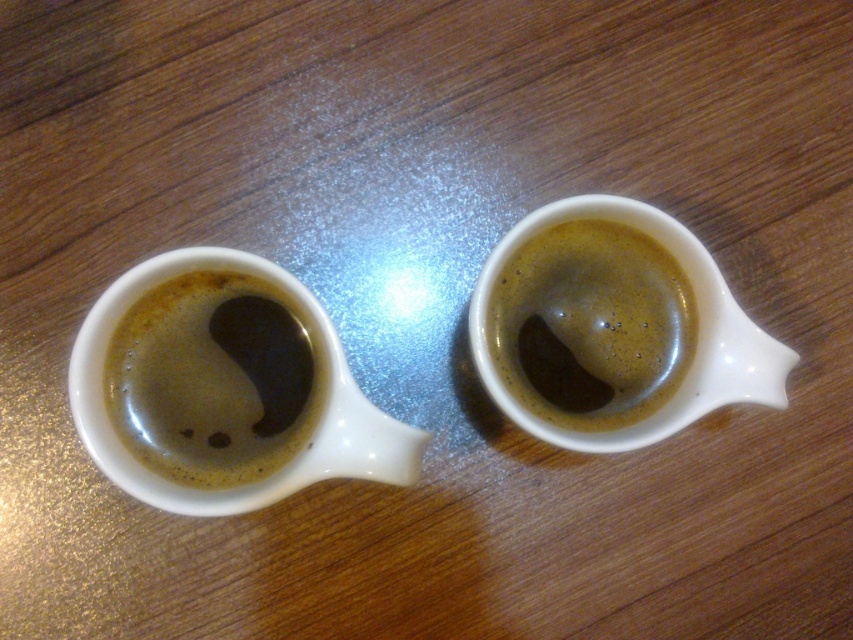
Question: Which point is closer to the camera?

Choices:
 (A) (239, 496)
 (B) (618, 264)
 (C) (236, 292)

Answer: (A)

Question: Does white ceramic mug at left have a lesser width compared to matte ceramic cup at right?

Choices:
 (A) yes
 (B) no

Answer: (B)

Question: Among these points, which one is farthest from the camera?

Choices:
 (A) (618, 230)
 (B) (321, 435)

Answer: (A)

Question: Can you confirm if matte ceramic cup at left is bigger than matte ceramic cup at right?

Choices:
 (A) no
 (B) yes

Answer: (B)

Question: Among these points, which one is nearest to the camera?

Choices:
 (A) (163, 492)
 (B) (225, 449)

Answer: (A)

Question: Does white ceramic mug at left appear on the right side of matte ceramic cup at left?

Choices:
 (A) yes
 (B) no

Answer: (A)